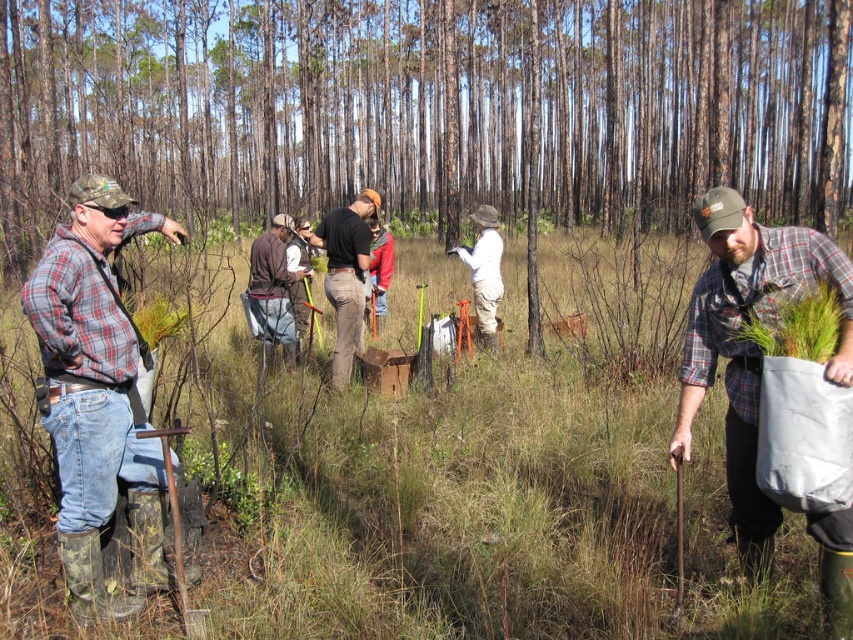
You are a hiker who has just entered the forest and see the green grass at center and the plaid flannel shirt at left. You need to cross the area between them to reach a stream. Can you walk straight through the space between them without any obstacles?

The distance between the green grass at center and plaid flannel shirt at left is 6.01 feet, so yes, you can walk straight through the space between them since there is enough room to pass without obstacles.

You are a hiker who has just entered the forest and sees the green grass at center and the plaid flannel shirt at center. Which object takes up more space in the scene?

The green grass at center is larger in size than the plaid flannel shirt at center, so the green grass at center takes up more space in the scene.

You are a hiker who has just entered the forest and see the green grass at center and the plaid flannel shirt at left. Which object is closer to you?

The plaid flannel shirt at left is closer to you since the green grass at center is positioned over it, indicating it is farther away.